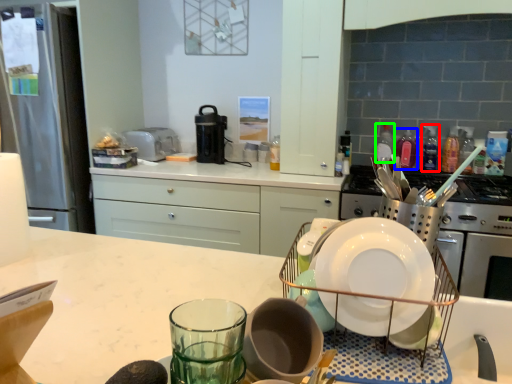
Question: Which object is positioned closest to bottle (highlighted by a red box)? Select from bottle (highlighted by a blue box) and bottle (highlighted by a green box).

Choices:
 (A) bottle
 (B) bottle

Answer: (A)